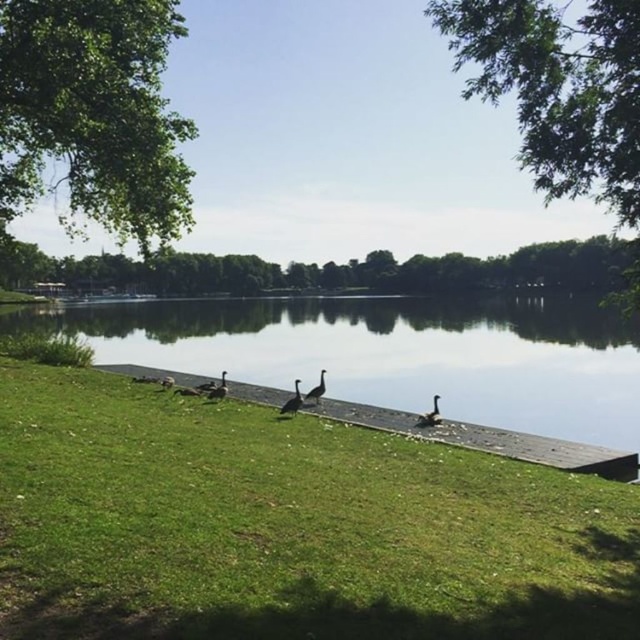
Question: Does brown wooden dock at lower center have a larger size compared to dark gray feathers at center?

Choices:
 (A) yes
 (B) no

Answer: (A)

Question: Which of the following is the closest to the observer?

Choices:
 (A) (614, 35)
 (B) (161, 384)

Answer: (A)

Question: Is green grass at center further to the viewer compared to dark brown feathers at lower left?

Choices:
 (A) yes
 (B) no

Answer: (B)

Question: In this image, where is dark gray feathers at center located relative to brown feathered duck at center?

Choices:
 (A) right
 (B) left

Answer: (A)

Question: Which of the following is the closest to the observer?

Choices:
 (A) dark brown feathers at lower left
 (B) brown feathered duck at center
 (C) dark gray feathered duck at center

Answer: (C)

Question: Which point is farther from the camera taking this photo?

Choices:
 (A) (584, 264)
 (B) (173, 384)
 (C) (332, 426)
 (D) (628, 470)

Answer: (A)